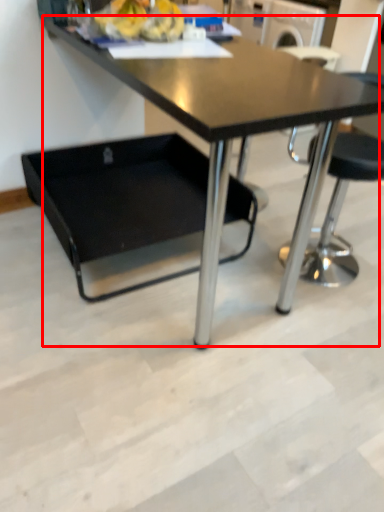
Question: From the image's perspective, what is the correct spatial positioning of table (annotated by the red box) in reference to swivel chair?

Choices:
 (A) below
 (B) above

Answer: (B)